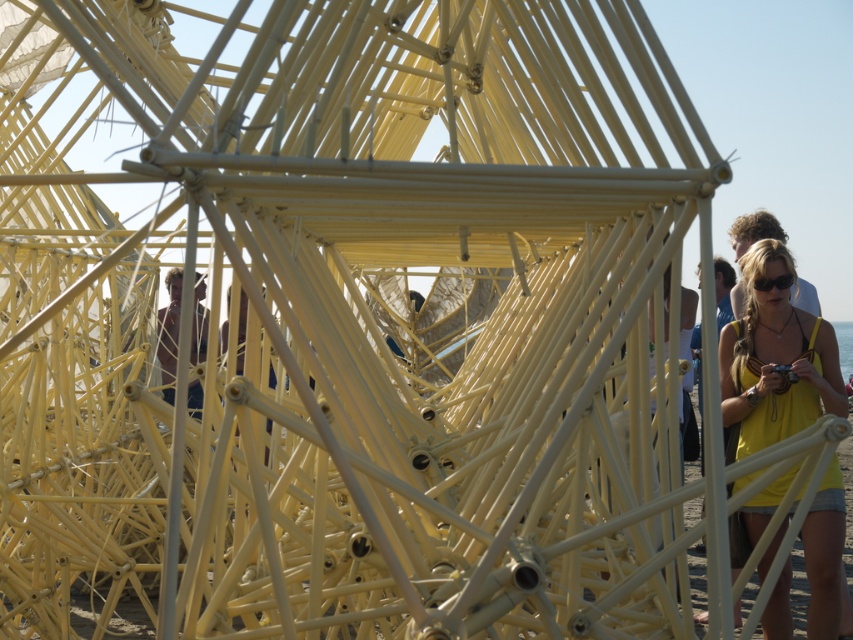
You are an artist trying to hang a new sculpture in the center of the yellow fabric top at right and the black matte sunglasses at center. Which object should you place the sculpture closer to to ensure it hangs above both?

The sculpture should be placed closer to the black matte sunglasses at center because the yellow fabric top at right is positioned under the black matte sunglasses at center, meaning the sunglasses are higher up. Placing the sculpture above the sunglasses would naturally place it above the fabric top as well.

You are standing in front of the yellow metal pipe structure and want to determine the position of two points marked on the structure. The first point is labeled as point (772, 362) and the second is point (785, 280). Which point is closer to you?

Point (772, 362) is further to the camera than point (785, 280), so the point closer to you is point (785, 280).